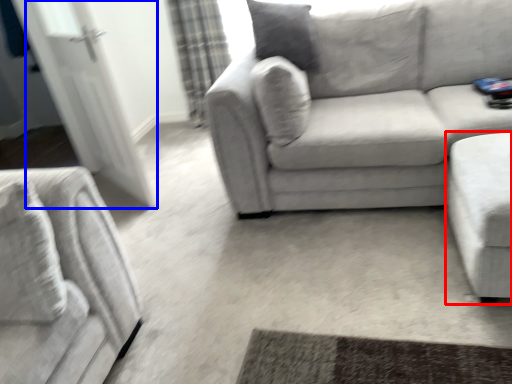
Question: Which of the following is the closest to the observer, studio couch (highlighted by a red box) or glass door (highlighted by a blue box)?

Choices:
 (A) studio couch
 (B) glass door

Answer: (A)